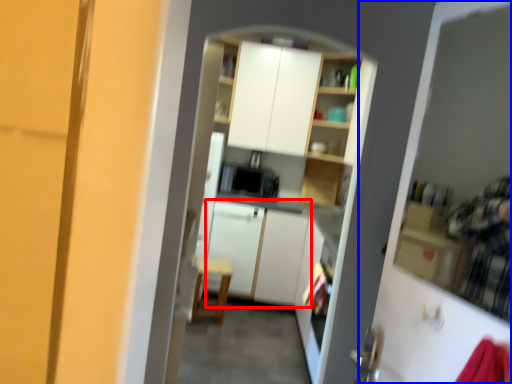
Question: Which object appears closest to the camera in this image, cabinetry (highlighted by a red box) or screen door (highlighted by a blue box)?

Choices:
 (A) cabinetry
 (B) screen door

Answer: (B)